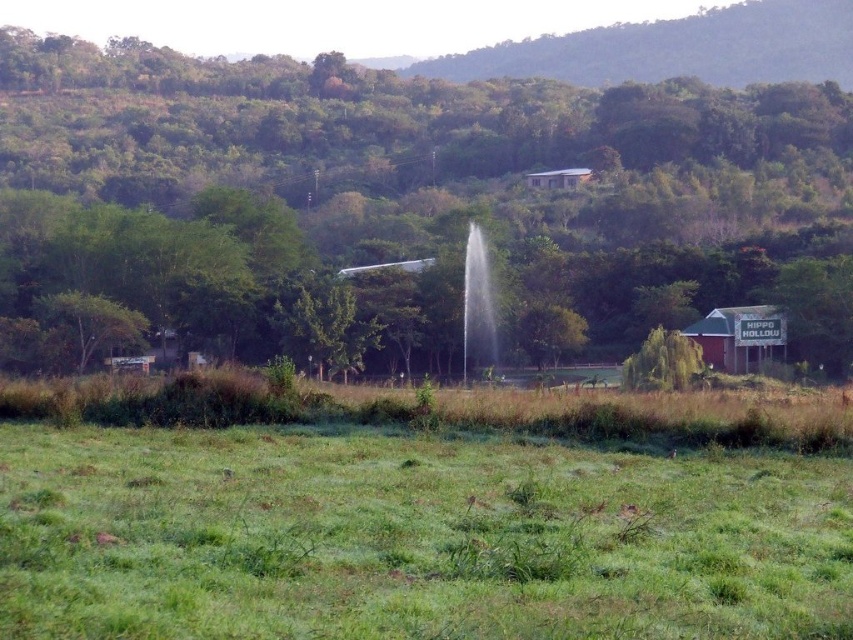
Question: Which object appears closest to the camera in this image?

Choices:
 (A) green leafy tree at center
 (B) green leafy tree at center-right

Answer: (B)

Question: Which point appears farthest from the camera in this image?

Choices:
 (A) (589, 51)
 (B) (25, 156)

Answer: (A)

Question: Does green leafy tree at center appear on the right side of green leafy tree at center-right?

Choices:
 (A) no
 (B) yes

Answer: (A)

Question: Can you confirm if green leafy tree at center is positioned to the left of green leafy hillside at upper center?

Choices:
 (A) yes
 (B) no

Answer: (A)

Question: Which is nearer to the green leafy tree at center?

Choices:
 (A) green leafy hillside at upper center
 (B) green leafy tree at center-right

Answer: (A)

Question: Can you confirm if green leafy tree at center is smaller than green leafy tree at center-right?

Choices:
 (A) yes
 (B) no

Answer: (B)